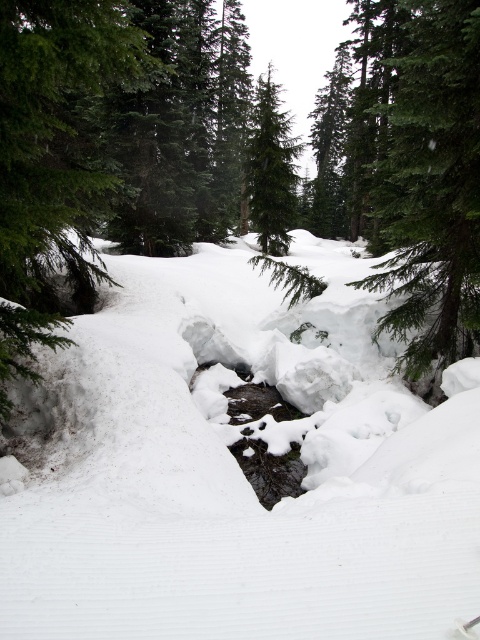
Question: Which of these objects is positioned farthest from the white fluffy snow at center?

Choices:
 (A) green matte tree at center
 (B) green textured tree at center

Answer: (A)

Question: Can you confirm if green textured tree at center is bigger than green matte tree at center?

Choices:
 (A) no
 (B) yes

Answer: (A)

Question: Observing the image, what is the correct spatial positioning of white fluffy snow at center in reference to green matte tree at center?

Choices:
 (A) right
 (B) left

Answer: (B)

Question: Which of the following is the farthest from the observer?

Choices:
 (A) green textured tree at center
 (B) white fluffy snow at center
 (C) green matte tree at center

Answer: (C)

Question: Can you confirm if white fluffy snow at center is positioned to the right of green matte tree at center?

Choices:
 (A) yes
 (B) no

Answer: (B)

Question: Which point is closer to the camera taking this photo?

Choices:
 (A) (456, 257)
 (B) (252, 129)
 (C) (283, 563)

Answer: (C)